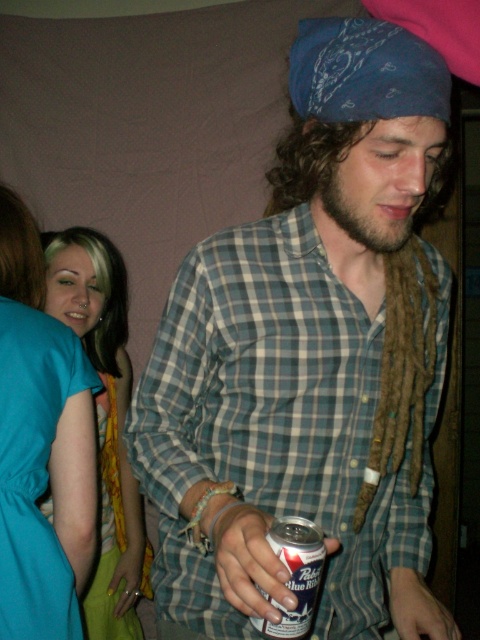
You are a fashion designer observing this scene. You notice the teal fabric dress at left and the yellow satin dress at lower left. Which dress is positioned higher in the image?

The teal fabric dress at left is located above the yellow satin dress at lower left, so it is positioned higher in the image.

You are a fashion designer observing the scene. You need to place a new accessory between the teal satin dress at left and the yellow satin dress at lower left. Which dress should the accessory be closer to if you want it to be closer to the left side of the image?

The teal satin dress at left is to the left of the yellow satin dress at lower left, so placing the accessory closer to the teal satin dress at left would position it nearer to the left side of the image.